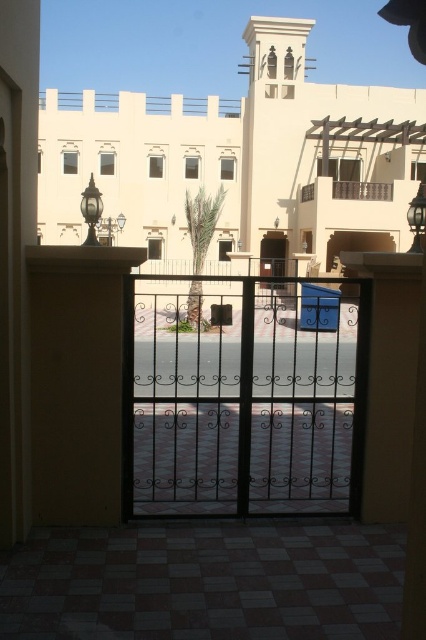
Who is higher up, black wrought iron gate at center or wooden slats balcony at upper center?

wooden slats balcony at upper center

Is black wrought iron gate at center above wooden slats balcony at upper center?

No.

Is point (146, 316) closer to viewer compared to point (382, 198)?

Yes, it is.

At what (x,y) coordinates should I click in order to perform the action: click on black wrought iron gate at center. Please return your answer as a coordinate pair (x, y). This screenshot has height=640, width=426. Looking at the image, I should click on (245, 397).

Which of these two, wooden slats balcony at upper center or clear glass screen door at center, stands shorter?

wooden slats balcony at upper center is shorter.

Between point (311, 186) and point (279, 250), which one is positioned behind?

The point (279, 250) is more distant.

Find the location of a particular element. The width and height of the screenshot is (426, 640). wooden slats balcony at upper center is located at coordinates (362, 189).

Which is more to the left, black wrought iron gate at center or clear glass screen door at center?

From the viewer's perspective, black wrought iron gate at center appears more on the left side.

Between black wrought iron gate at center and clear glass screen door at center, which one has less height?

With less height is clear glass screen door at center.

Who is more forward, (141, 476) or (279, 248)?

Positioned in front is point (141, 476).

The image size is (426, 640). Identify the location of black wrought iron gate at center. 245,397.